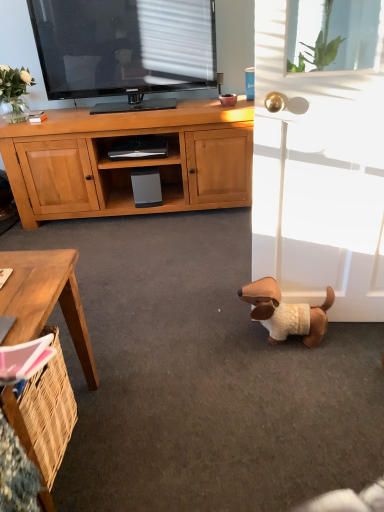
At what (x,y) coordinates should I click in order to perform the action: click on empty space that is to the right of brown wooden desk at lower left. Please return your answer as a coordinate pair (x, y). This screenshot has height=512, width=384. Looking at the image, I should click on (164, 424).